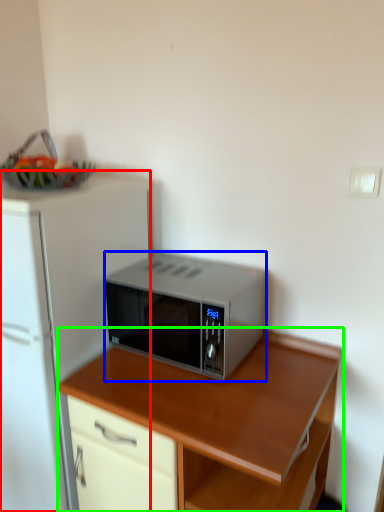
Question: Which object is the farthest from refrigerator (highlighted by a red box)? Choose among these: microwave oven (highlighted by a blue box) or desk (highlighted by a green box).

Choices:
 (A) microwave oven
 (B) desk

Answer: (B)